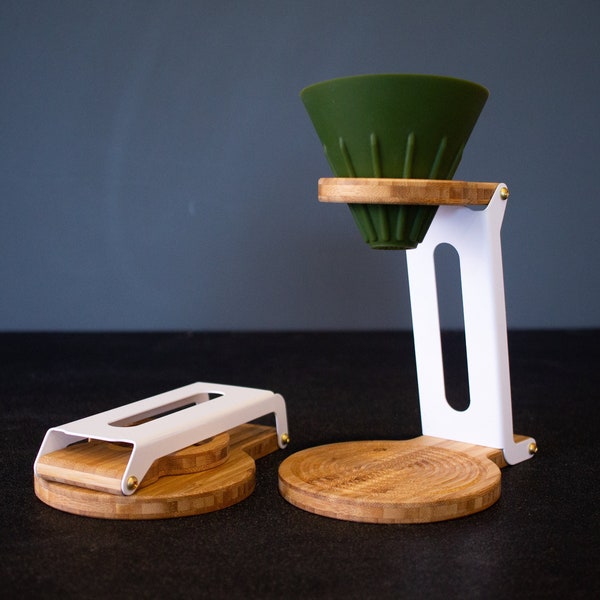
What are the coordinates of `counter` in the screenshot? It's located at (276, 537).